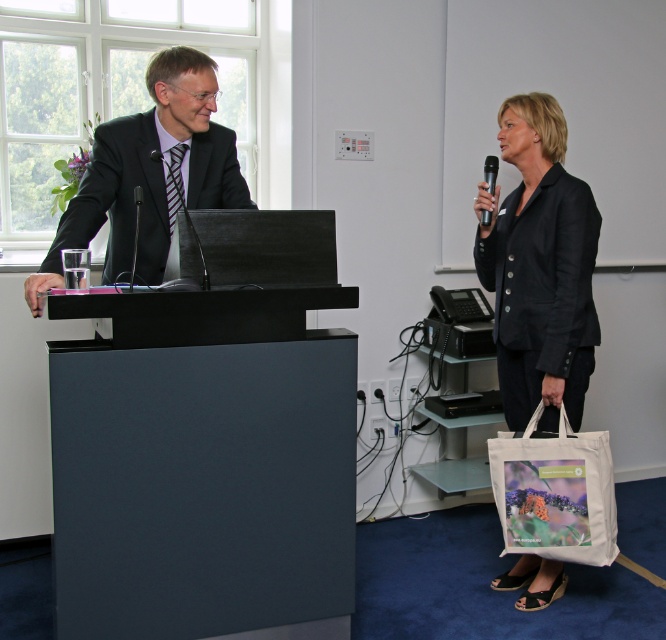
Which is below, matte black suit at left or black plastic microphone at upper right?

matte black suit at left is below.

Which is in front, point (212, 176) or point (494, 186)?

Point (212, 176) is more forward.

This screenshot has height=640, width=666. Identify the location of matte black suit at left. (149, 173).

Which is more to the right, black matte blazer at right or black plastic microphone at upper right?

Positioned to the right is black matte blazer at right.

Is black matte blazer at right closer to camera compared to black plastic microphone at upper right?

Yes, black matte blazer at right is closer to the viewer.

In order to click on black matte blazer at right in this screenshot , I will do `click(539, 268)`.

Image resolution: width=666 pixels, height=640 pixels. In order to click on black matte blazer at right in this screenshot , I will do `click(539, 268)`.

Which is more to the right, matte black podium at left or black matte blazer at right?

black matte blazer at right

Does matte black podium at left have a greater height compared to black matte blazer at right?

In fact, matte black podium at left may be shorter than black matte blazer at right.

Does point (244, 310) lie in front of point (555, 314)?

Yes, it is in front of point (555, 314).

You are a GUI agent. You are given a task and a screenshot of the screen. Output one action in this format:
    pyautogui.click(x=<x>, y=<y>)
    Task: Click on the matte black podium at left
    Image resolution: width=666 pixels, height=640 pixels.
    Given the screenshot: What is the action you would take?
    pyautogui.click(x=202, y=464)